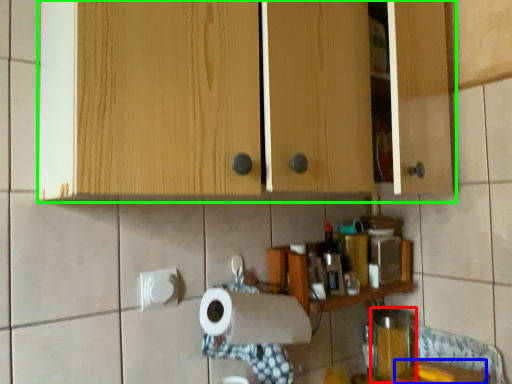
Question: Considering the real-world distances, which object is farthest from appliance (highlighted by a red box)? counter top (highlighted by a blue box) or cabinetry (highlighted by a green box)?

Choices:
 (A) counter top
 (B) cabinetry

Answer: (B)